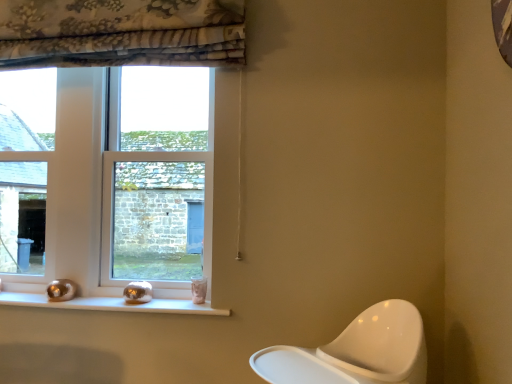
Question: Is clear glass window at center, which is the first window in right-to-left order, not inside white glossy window sill at lower center?

Choices:
 (A) no
 (B) yes

Answer: (B)

Question: From a real-world perspective, does clear glass window at center, the second window positioned from the left, sit lower than white glossy window sill at lower center?

Choices:
 (A) no
 (B) yes

Answer: (A)

Question: Can you confirm if clear glass window at center, which is the first window in right-to-left order, is taller than white glossy window sill at lower center?

Choices:
 (A) yes
 (B) no

Answer: (A)

Question: Is the position of clear glass window at center, the second window positioned from the left, less distant than that of white glossy window sill at lower center?

Choices:
 (A) no
 (B) yes

Answer: (A)

Question: From the image's perspective, is clear glass window at center, which is the first window in right-to-left order, located above white glossy window sill at lower center?

Choices:
 (A) no
 (B) yes

Answer: (B)

Question: Considering the relative sizes of clear glass window at center, the second window positioned from the left, and white glossy window sill at lower center in the image provided, is clear glass window at center, the second window positioned from the left, shorter than white glossy window sill at lower center?

Choices:
 (A) no
 (B) yes

Answer: (A)

Question: Is there a large distance between clear glass window at center, which is the first window in right-to-left order, and clear glass window at left, the second window when ordered from right to left?

Choices:
 (A) no
 (B) yes

Answer: (A)

Question: Does clear glass window at center, which is the first window in right-to-left order, have a greater width compared to clear glass window at left, the second window when ordered from right to left?

Choices:
 (A) yes
 (B) no

Answer: (A)

Question: Is clear glass window at center, which is the first window in right-to-left order, shorter than clear glass window at left, which is the 1th window from left to right?

Choices:
 (A) no
 (B) yes

Answer: (B)

Question: Considering the relative sizes of clear glass window at center, which is the first window in right-to-left order, and clear glass window at left, which is the 1th window from left to right, in the image provided, is clear glass window at center, which is the first window in right-to-left order, taller than clear glass window at left, which is the 1th window from left to right,?

Choices:
 (A) no
 (B) yes

Answer: (A)

Question: Is clear glass window at left, which is the 1th window from left to right, inside clear glass window at center, the second window positioned from the left?

Choices:
 (A) no
 (B) yes

Answer: (A)

Question: Is clear glass window at center, the second window positioned from the left, oriented towards clear glass window at left, which is the 1th window from left to right?

Choices:
 (A) yes
 (B) no

Answer: (B)

Question: Is clear glass window at left, which is the 1th window from left to right, positioned beyond the bounds of clear glass window at center, the second window positioned from the left?

Choices:
 (A) yes
 (B) no

Answer: (A)